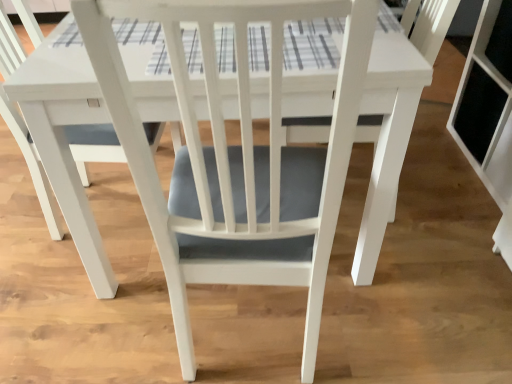
The width and height of the screenshot is (512, 384). What do you see at coordinates (429, 24) in the screenshot?
I see `white matte chair at center` at bounding box center [429, 24].

Locate an element on the screen. The image size is (512, 384). white matte chair at center is located at coordinates (429, 24).

Locate an element on the screen. white matte chair at center is located at coordinates click(429, 24).